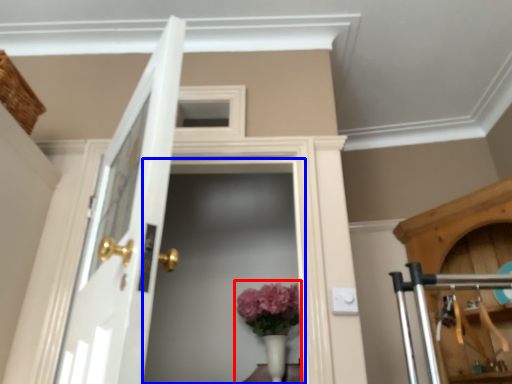
Question: Which object appears closest to the camera in this image, floral arrangement (highlighted by a red box) or screen door (highlighted by a blue box)?

Choices:
 (A) floral arrangement
 (B) screen door

Answer: (B)